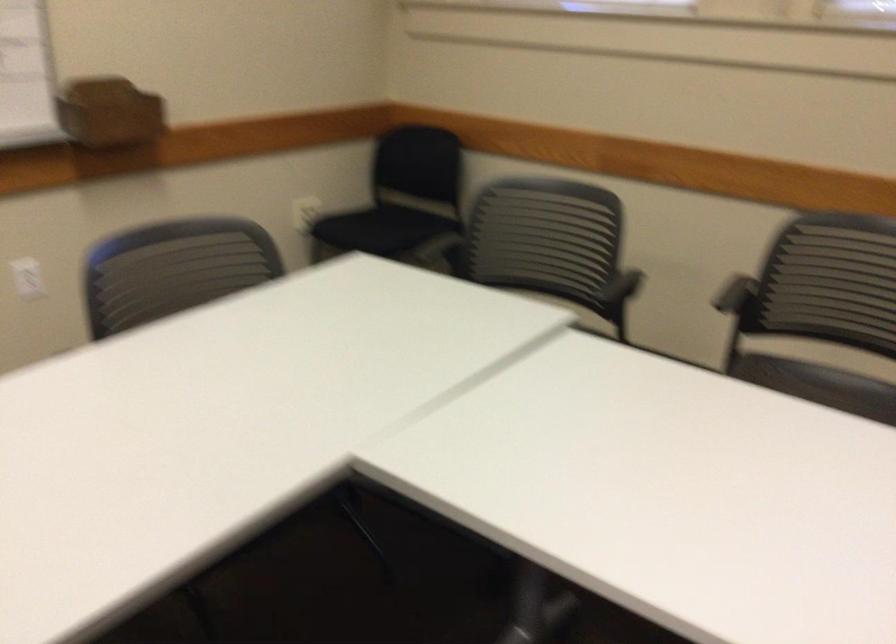
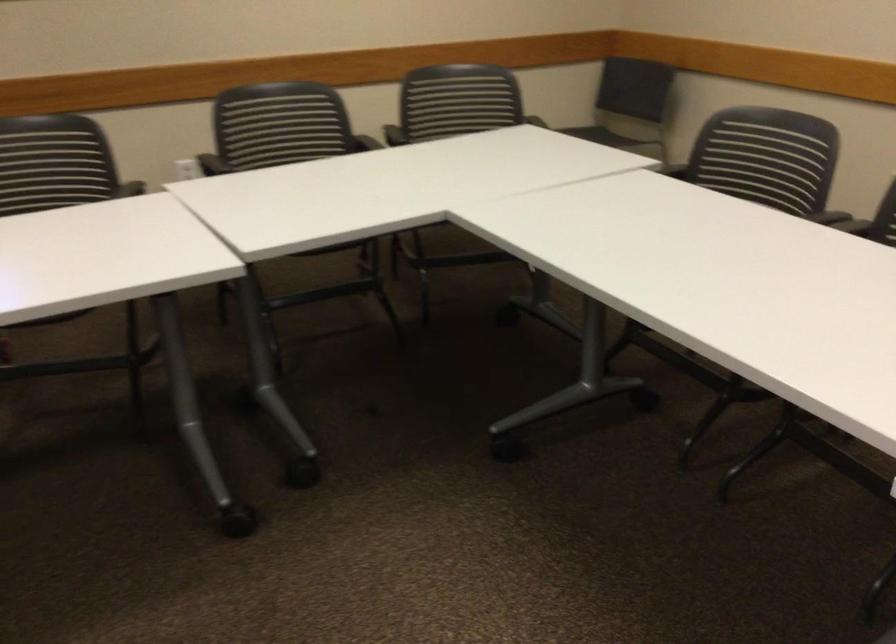
First-person continuous shooting, in which direction is the camera rotating?

The camera's rotation is toward right-down.